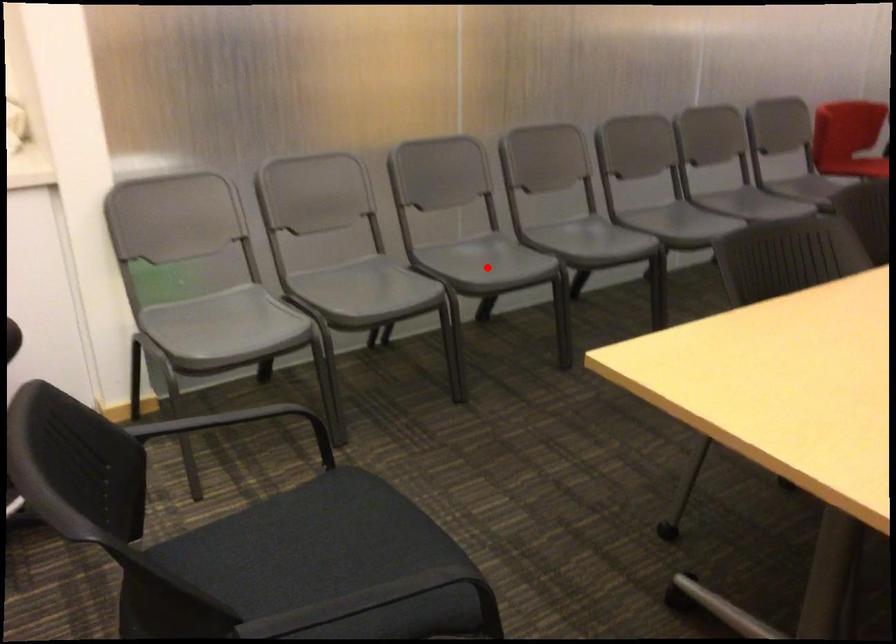
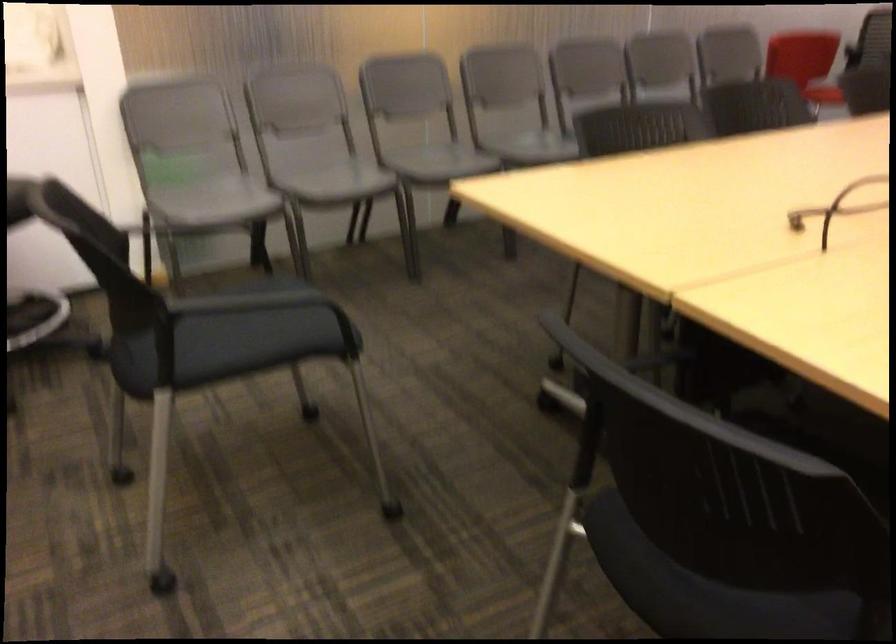
Locate, in the second image, the point that corresponds to the highlighted location in the first image.

(436, 161)